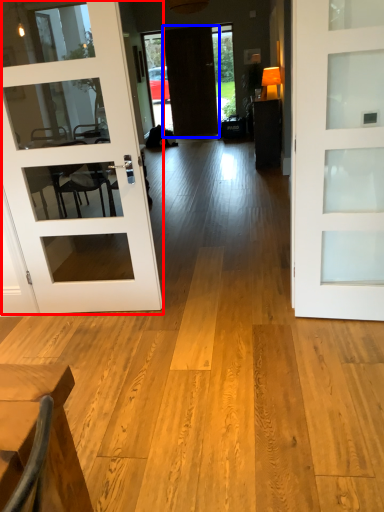
Question: Which point is closer to the camera, door (highlighted by a red box) or door (highlighted by a blue box)?

Choices:
 (A) door
 (B) door

Answer: (A)